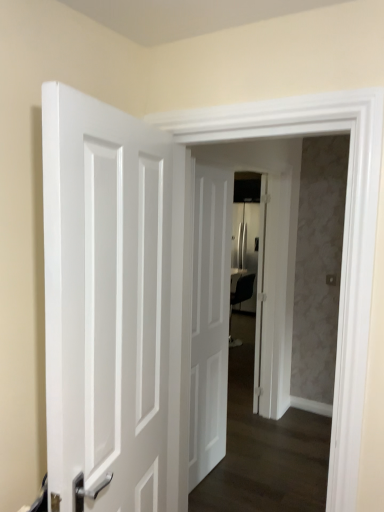
Question: Should I look upward or downward to see white glossy door at left, the first door when ordered from front to back?

Choices:
 (A) down
 (B) up

Answer: (A)

Question: Is white matte door at center, the second door in the front-to-back sequence, positioned behind white glossy door at left, placed as the third door when sorted from right to left?

Choices:
 (A) yes
 (B) no

Answer: (A)

Question: From a real-world perspective, is white matte door at center, the second door in the front-to-back sequence, physically above white glossy door at left, placed as the third door when sorted from right to left?

Choices:
 (A) yes
 (B) no

Answer: (B)

Question: Considering the relative positions of white matte door at center, the second door in the front-to-back sequence, and white glossy door at left, the first door when ordered from front to back, in the image provided, is white matte door at center, the second door in the front-to-back sequence, to the right of white glossy door at left, the first door when ordered from front to back, from the viewer's perspective?

Choices:
 (A) no
 (B) yes

Answer: (B)

Question: Is white matte door at center, placed as the second door when sorted from back to front, turned away from white glossy door at left, marked as the first door in a left-to-right arrangement?

Choices:
 (A) no
 (B) yes

Answer: (A)

Question: Is white matte door at center, positioned as the 2th door in left-to-right order, at the left side of white glossy door at left, placed as the third door when sorted from right to left?

Choices:
 (A) no
 (B) yes

Answer: (A)

Question: Is white matte door at center, placed as the second door when sorted from right to left, not close to white glossy door at left, marked as the first door in a left-to-right arrangement?

Choices:
 (A) no
 (B) yes

Answer: (B)

Question: Could white glossy door at center, the third door in the front-to-back sequence, be considered to be inside white glossy door at center?

Choices:
 (A) yes
 (B) no

Answer: (A)

Question: From the image's perspective, is white glossy door at center located above white glossy door at center, the first door when ordered from right to left?

Choices:
 (A) yes
 (B) no

Answer: (B)

Question: Could you tell me if white glossy door at center is turned towards white glossy door at center, positioned as the third door in left-to-right order?

Choices:
 (A) no
 (B) yes

Answer: (A)

Question: Can you confirm if white glossy door at center is taller than white glossy door at center, positioned as the third door in left-to-right order?

Choices:
 (A) no
 (B) yes

Answer: (B)

Question: Can you confirm if white glossy door at center is positioned to the left of white glossy door at center, placed as the first door when sorted from back to front?

Choices:
 (A) no
 (B) yes

Answer: (B)

Question: Does white glossy door at center have a greater width compared to white glossy door at center, the first door when ordered from right to left?

Choices:
 (A) no
 (B) yes

Answer: (B)

Question: From the image's perspective, does white glossy door at center, placed as the first door when sorted from back to front, appear higher than white glossy door at left, the third door when ordered from back to front?

Choices:
 (A) yes
 (B) no

Answer: (A)